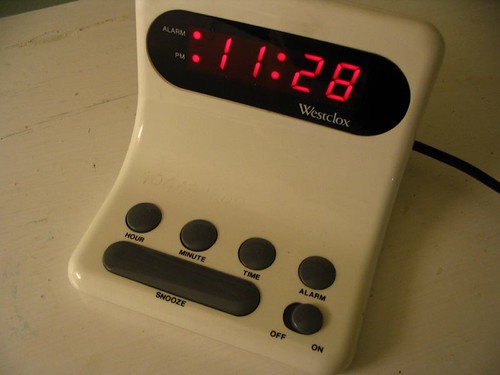
Where is `clock name - westclock`? The image size is (500, 375). clock name - westclock is located at coordinates (318, 115).